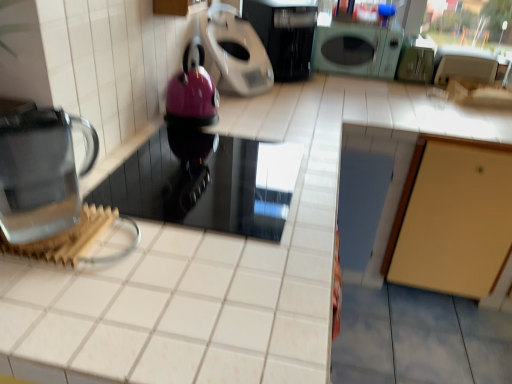
Identify the location of free location to the right of black glossy microwave at upper center, which is the 1th kitchen appliance in right-to-left order. (345, 85).